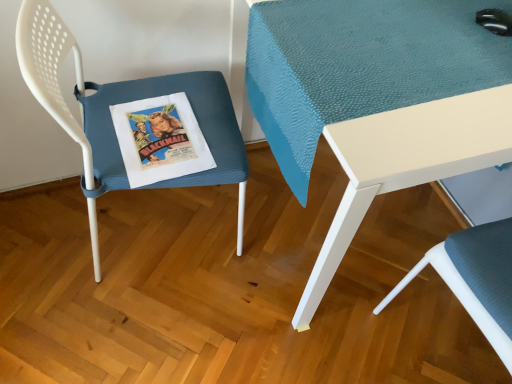
Locate an element on the screen. The height and width of the screenshot is (384, 512). free location in front of blue textured cushion at left, which appears as the 2th chair when viewed from the right is located at coordinates (138, 333).